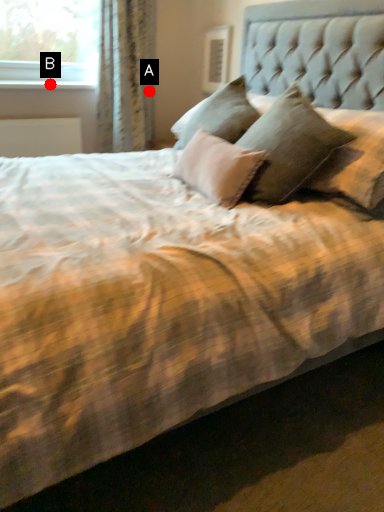
Question: Two points are circled on the image, labeled by A and B beside each circle. Which point is closer to the camera?

Choices:
 (A) A is closer
 (B) B is closer

Answer: (B)